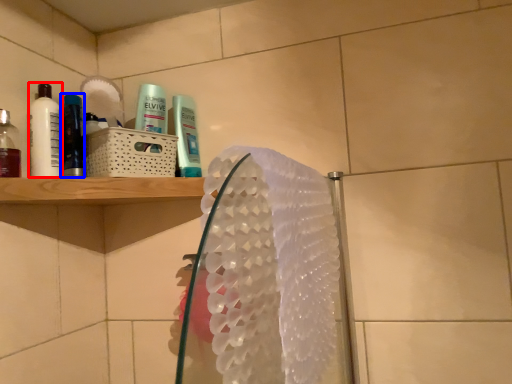
Question: Among these objects, which one is nearest to the camera, mouthwash (highlighted by a red box) or mouthwash (highlighted by a blue box)?

Choices:
 (A) mouthwash
 (B) mouthwash

Answer: (A)